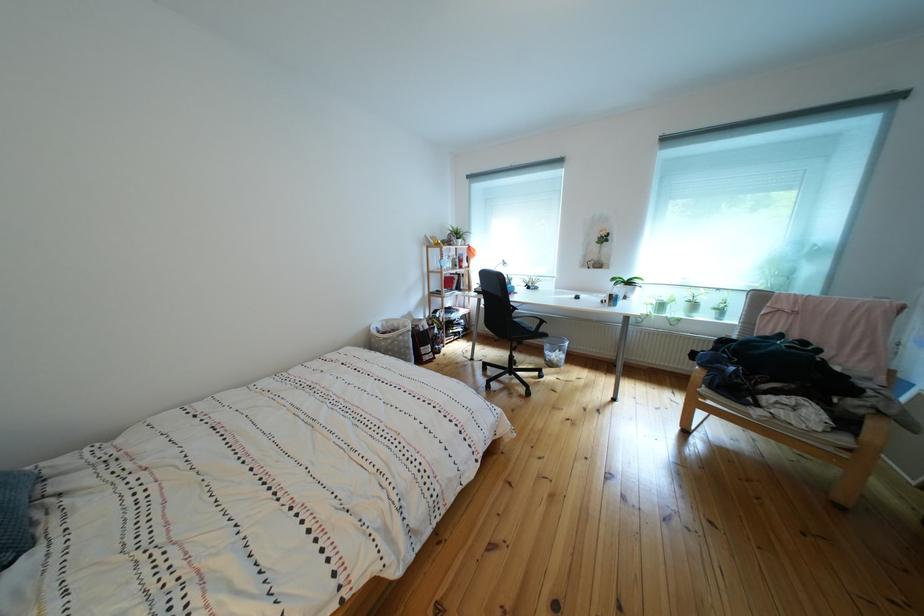
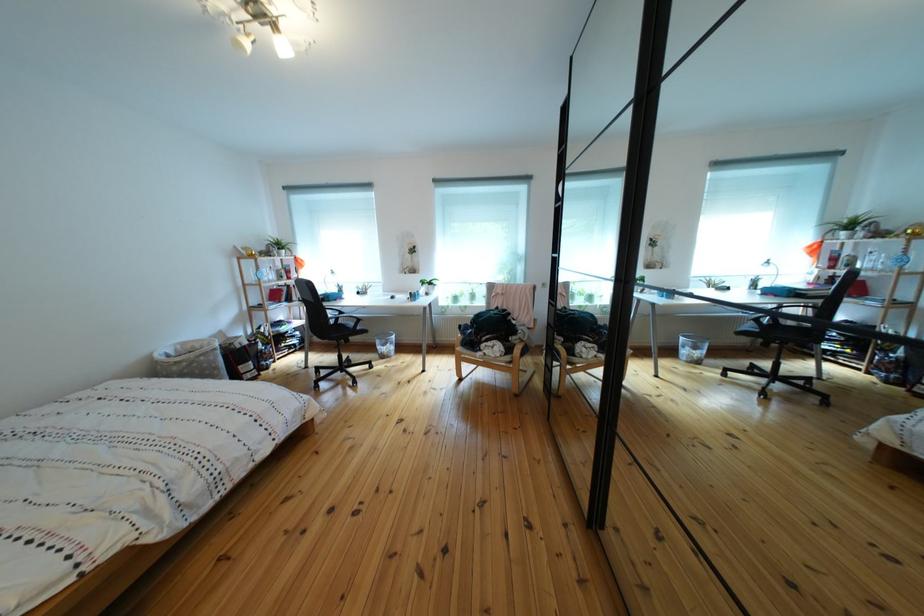
Find the pixel in the second image that matches (394,331) in the first image.

(187, 355)